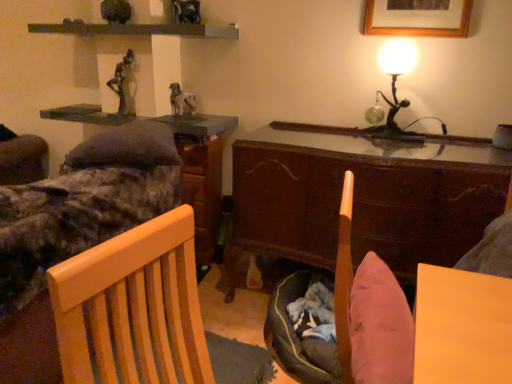
Question: Is point (408, 24) positioned closer to the camera than point (116, 72)?

Choices:
 (A) farther
 (B) closer

Answer: (B)

Question: Is wooden picture frame at upper right wider or thinner than bronze statue at upper center?

Choices:
 (A) wide
 (B) thin

Answer: (B)

Question: Which object is the farthest from the wooden shelf at upper center?

Choices:
 (A) light wood chair at left
 (B) bronze statue at upper center
 (C) metallic gold table lamp at upper right
 (D) wooden picture frame at upper right
 (E) furry white dog at center

Answer: (A)

Question: Which is farther from the wooden bed frame at left?

Choices:
 (A) matte gray table at upper left
 (B) bronze statue at upper center
 (C) furry white dog at center
 (D) wooden shelf at upper center
 (E) wooden file cabinet at center

Answer: (D)